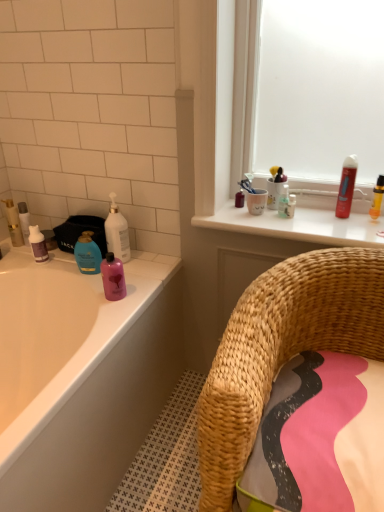
I want to click on free space in front of white glossy bottle at upper left, so click(130, 278).